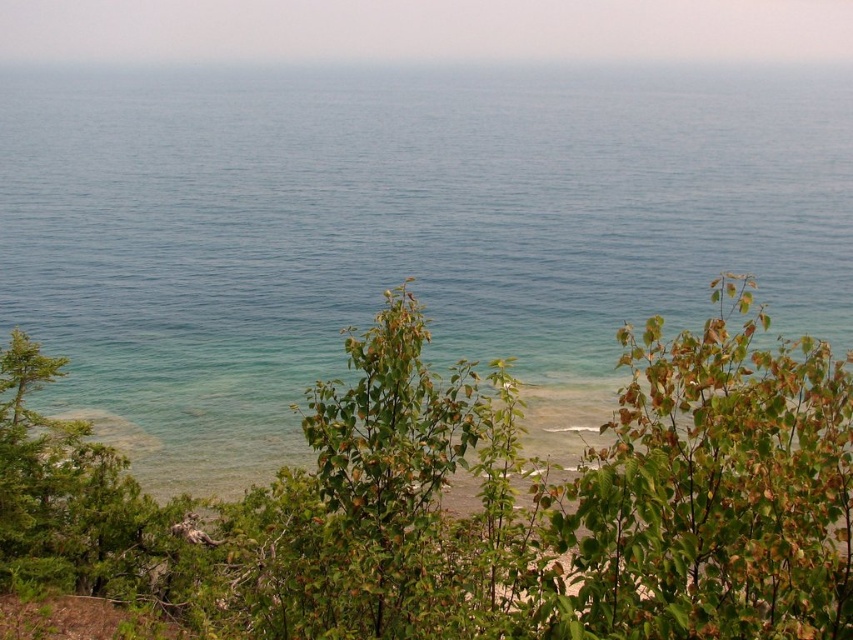
Is clear blue water at center above green leafy shrub at center?

Yes, clear blue water at center is above green leafy shrub at center.

Image resolution: width=853 pixels, height=640 pixels. I want to click on clear blue water at center, so click(397, 232).

Is point (596, 106) in front of point (706, 600)?

That is False.

Where is `clear blue water at center`? The image size is (853, 640). clear blue water at center is located at coordinates (397, 232).

How distant is clear blue water at center from green leafy tree at center?

They are 68.21 meters apart.

Identify the location of clear blue water at center. pos(397,232).

Where is `clear blue water at center`? clear blue water at center is located at coordinates (397, 232).

What are the coordinates of `clear blue water at center` in the screenshot? It's located at (397, 232).

Who is lower down, green leafy tree at center or green leafy shrub at center?

Positioned lower is green leafy tree at center.

Is green leafy tree at center below green leafy shrub at center?

Yes.

Between point (764, 438) and point (761, 490), which one is positioned in front?

Point (761, 490) is in front.

Identify the location of green leafy tree at center. The width and height of the screenshot is (853, 640). (479, 500).